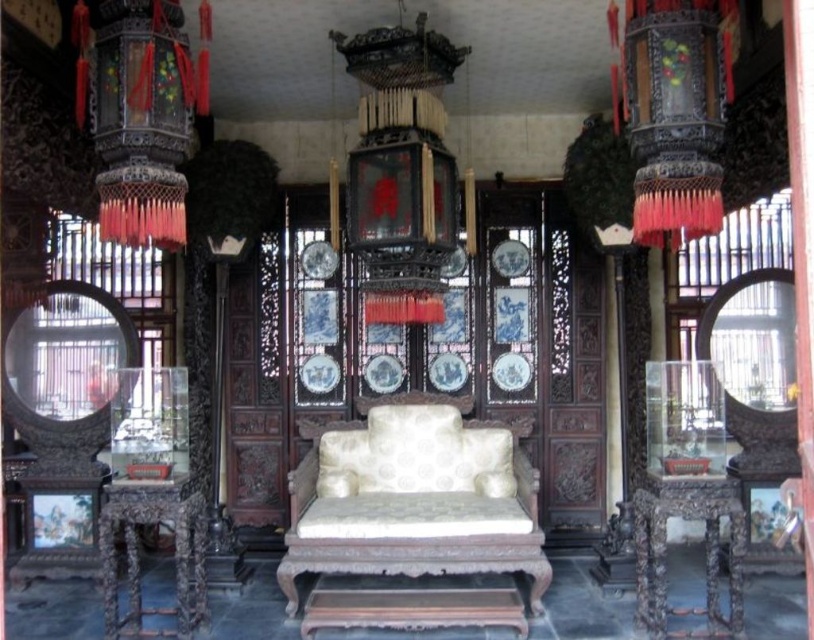
Who is more distant from viewer, (292,580) or (731,563)?

Positioned behind is point (292,580).

Is white upholstered armchair at center smaller than dark brown wood side table at lower right?

No.

You are a GUI agent. You are given a task and a screenshot of the screen. Output one action in this format:
    pyautogui.click(x=<x>, y=<y>)
    Task: Click on the white upholstered armchair at center
    
    Given the screenshot: What is the action you would take?
    pyautogui.click(x=414, y=497)

Who is lower down, black lacquered lantern at center or black lacquered lantern at upper right?

black lacquered lantern at upper right is lower down.

Is black lacquered lantern at center below black lacquered lantern at upper right?

Incorrect, black lacquered lantern at center is not positioned below black lacquered lantern at upper right.

Which is in front, point (396, 186) or point (628, 58)?

Point (628, 58)

Where is `black lacquered lantern at center`? black lacquered lantern at center is located at coordinates (401, 170).

Is white upholstered armchair at center shorter than black lacquered lantern at upper right?

Incorrect, white upholstered armchair at center's height does not fall short of black lacquered lantern at upper right's.

Does white upholstered armchair at center appear on the left side of black lacquered lantern at upper right?

Yes, white upholstered armchair at center is to the left of black lacquered lantern at upper right.

Is point (355, 515) behind point (685, 22)?

Yes, point (355, 515) is behind point (685, 22).

The width and height of the screenshot is (814, 640). I want to click on white upholstered armchair at center, so click(x=414, y=497).